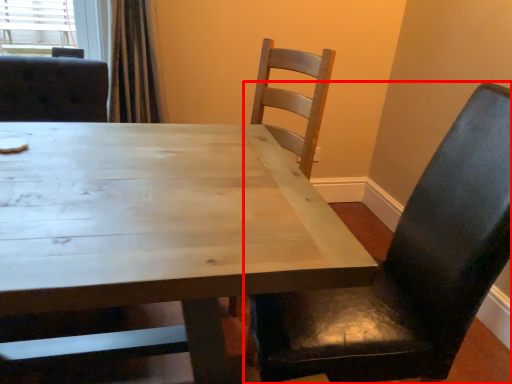
Question: From the image's perspective, where is chair (annotated by the red box) located relative to table?

Choices:
 (A) above
 (B) below

Answer: (A)